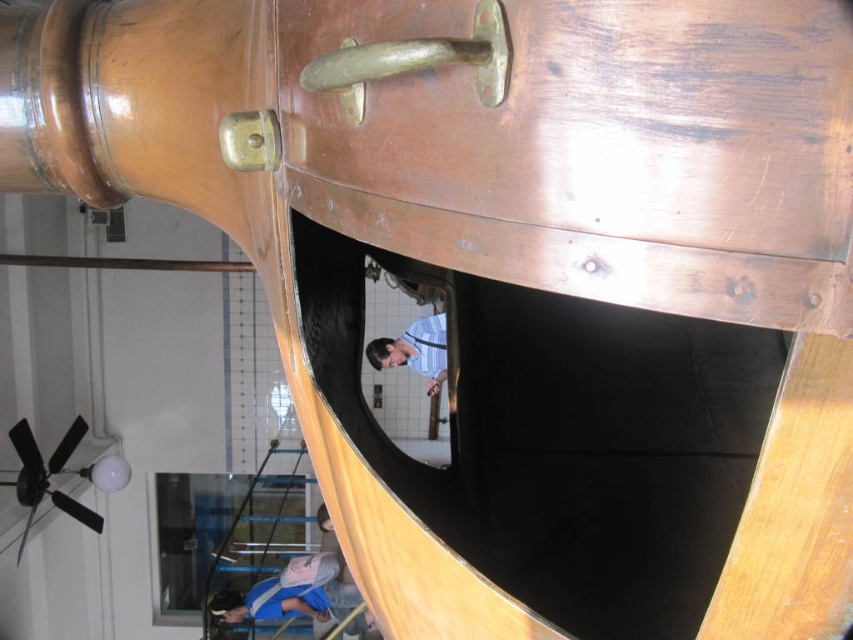
Can you confirm if matte blue shirt at center is wider than brass/bronze metallic door handle at upper center?

Yes, matte blue shirt at center is wider than brass/bronze metallic door handle at upper center.

Does point (373, 353) come in front of point (228, 163)?

No, it is not.

The width and height of the screenshot is (853, 640). Describe the element at coordinates (415, 349) in the screenshot. I see `matte blue shirt at center` at that location.

Image resolution: width=853 pixels, height=640 pixels. In order to click on matte blue shirt at center in this screenshot , I will do `click(415, 349)`.

Can you confirm if brass/bronze handle at upper center is positioned to the left of brass/bronze metallic door handle at upper center?

Incorrect, brass/bronze handle at upper center is not on the left side of brass/bronze metallic door handle at upper center.

Who is taller, brass/bronze handle at upper center or brass/bronze metallic door handle at upper center?

Standing taller between the two is brass/bronze handle at upper center.

Who is more distant from viewer, (491, 58) or (235, 124)?

The point (235, 124) is more distant.

Where is `brass/bronze handle at upper center`? The width and height of the screenshot is (853, 640). brass/bronze handle at upper center is located at coordinates (416, 61).

Is point (418, 44) positioned behind point (413, 368)?

No, it is in front of (413, 368).

Which is behind, point (354, 109) or point (418, 321)?

The point (418, 321) is behind.

Image resolution: width=853 pixels, height=640 pixels. What do you see at coordinates (416, 61) in the screenshot? I see `brass/bronze handle at upper center` at bounding box center [416, 61].

In order to click on brass/bronze handle at upper center in this screenshot , I will do `click(416, 61)`.